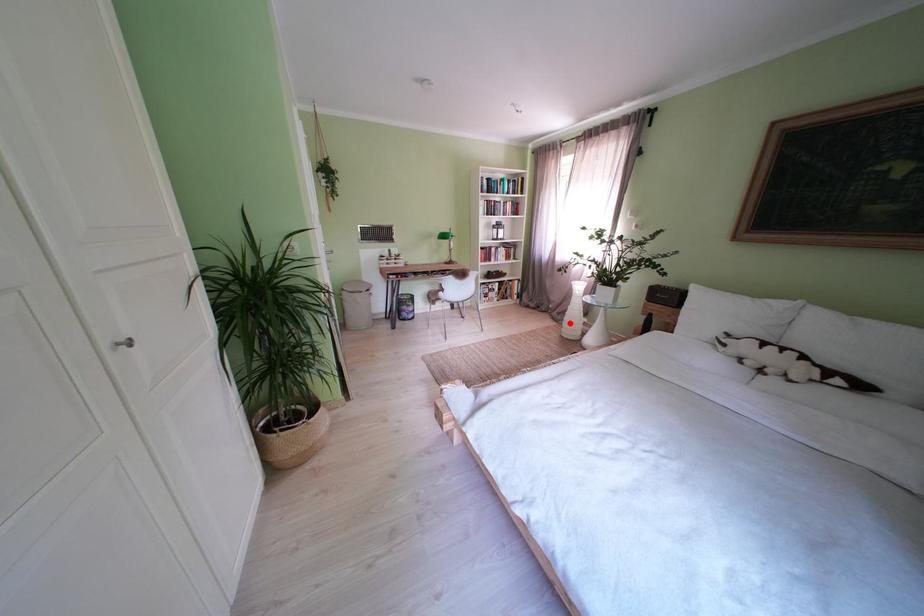
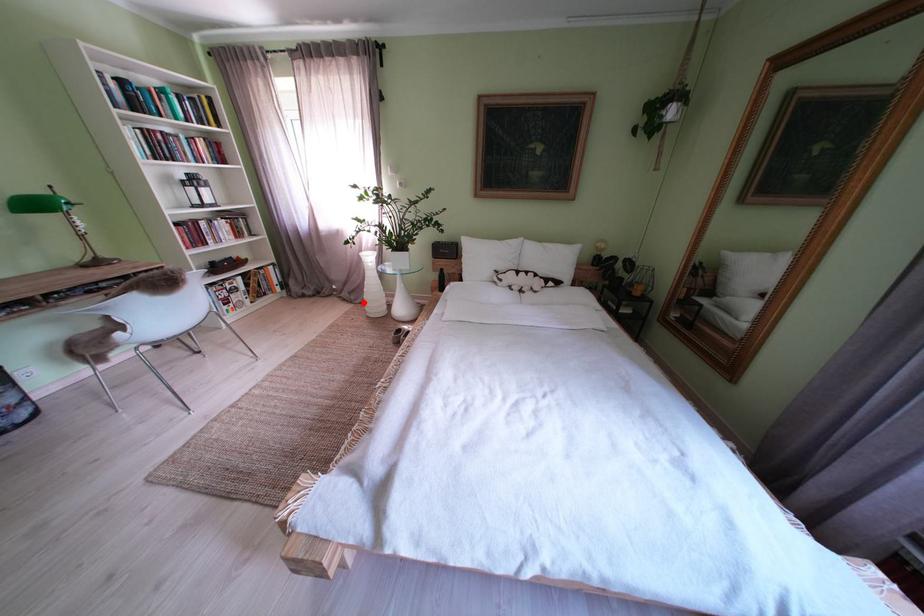
I am providing you with two images of the same scene from different viewpoints. A red point is marked on the first image and another point is marked on the second image. Are the points marked in image1 and image2 representing the same 3D position?

Yes